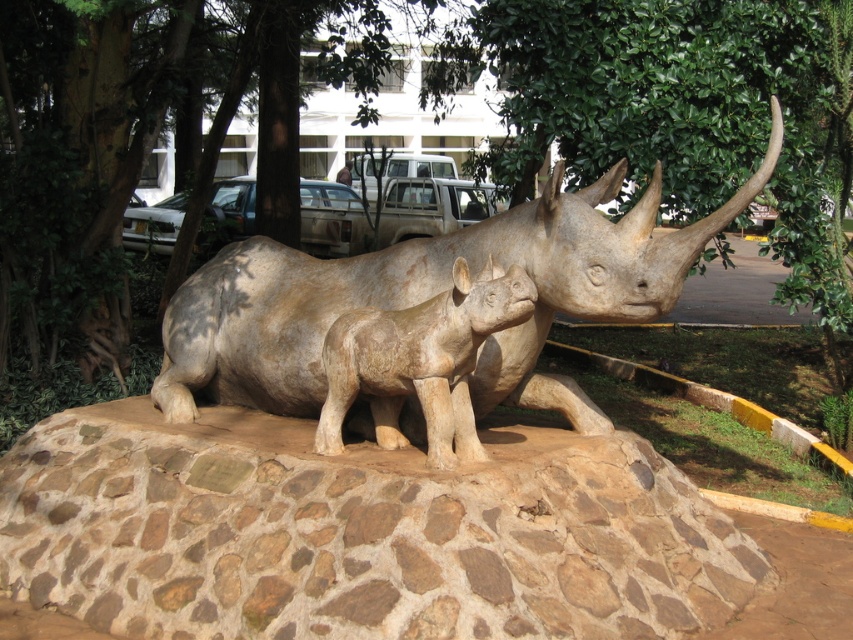
You are an art conservator examining the sculpture. You notice a brown stone at center and a matte beige rhino at center. Which object is positioned to the left when viewed from the front?

The brown stone at center is to the left of the matte beige rhino at center when viewed from the front.

You are an art curator planning to display the two rhinoceros sculptures in a narrow hallway. The adult rhino is labeled as the matte stone rhinoceros at center and the juvenile as the matte beige rhino at center. Given the space constraints, which sculpture should be placed first to ensure both fit side by side?

The matte stone rhinoceros at center is wider than the matte beige rhino at center. To fit both sculptures side by side in the narrow hallway, place the wider matte stone rhinoceros at center first, followed by the narrower matte beige rhino at center.

You are a sculptor who wants to place a new small statue on the highest point of the pedestal. Looking at the sculpture of the matte beige rhino at center and the brown stone at center, which object should you choose as the base for your new statue?

The matte beige rhino at center is taller than the brown stone at center, so you should place the new statue on the matte beige rhino at center since it has a greater height.